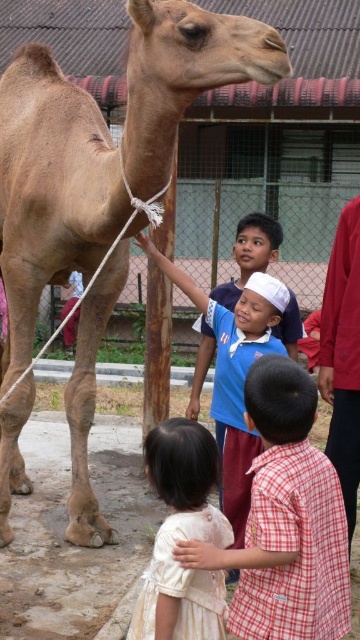
Question: Which object is farther from the camera taking this photo?

Choices:
 (A) white cotton shirt at center
 (B) blue cotton shirt at center

Answer: (B)

Question: Is white cotton dress at lower center to the right of blue cotton shirt at center from the viewer's perspective?

Choices:
 (A) yes
 (B) no

Answer: (B)

Question: Is brown textured camel at left further to the viewer compared to blue cotton shirt at center?

Choices:
 (A) yes
 (B) no

Answer: (B)

Question: Which point appears closest to the camera in this image?

Choices:
 (A) (257, 531)
 (B) (275, 300)

Answer: (A)

Question: Which point is farther from the camera taking this photo?

Choices:
 (A) (223, 586)
 (B) (168, 86)

Answer: (B)

Question: Can you confirm if white cotton shirt at center is positioned to the left of white cotton dress at lower center?

Choices:
 (A) no
 (B) yes

Answer: (A)